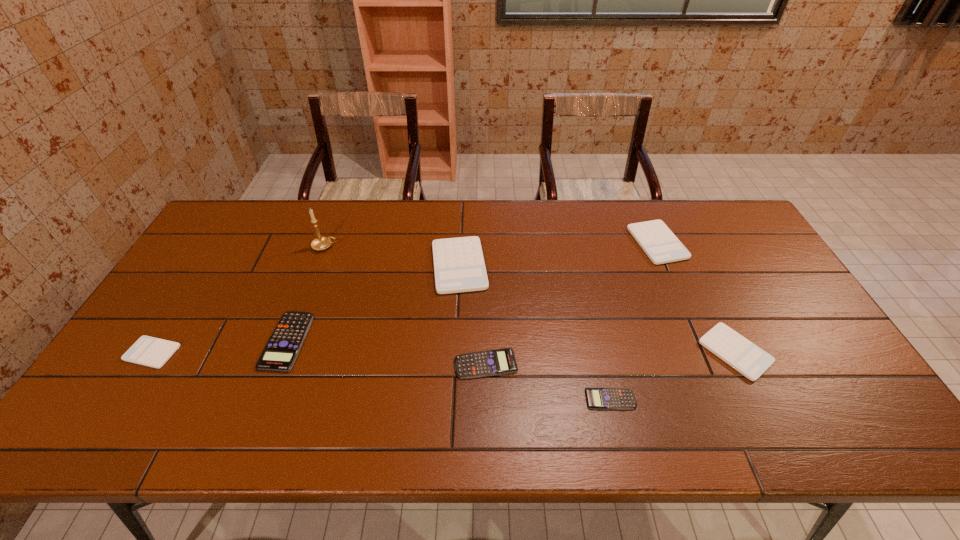
Identify the location of free space located 0.300m on the right of the leftmost white calculator. The height and width of the screenshot is (540, 960). (293, 353).

Locate an element on the screen. The height and width of the screenshot is (540, 960). free space located on the left of the second calculator from left to right is located at coordinates pos(142,341).

Image resolution: width=960 pixels, height=540 pixels. Find the location of `vacant space situated on the back of the second blue calculator from left to right`. vacant space situated on the back of the second blue calculator from left to right is located at coordinates (485, 249).

The image size is (960, 540). In order to click on free space located on the left of the rightmost blue calculator in this screenshot , I will do `click(446, 399)`.

The image size is (960, 540). Identify the location of candle holder that is at the far edge. (320, 243).

The height and width of the screenshot is (540, 960). I want to click on object present at the near edge, so coord(597,398).

The image size is (960, 540). What are the coordinates of `object present at the left edge` in the screenshot? It's located at (149, 351).

At what (x,y) coordinates should I click in order to perform the action: click on object situated at the right edge. Please return your answer as a coordinate pair (x, y). This screenshot has height=540, width=960. Looking at the image, I should click on (751, 361).

Locate an element on the screen. vacant space at the far edge of the desktop is located at coordinates (596, 217).

Where is `vacant space at the near edge of the desktop`? This screenshot has height=540, width=960. vacant space at the near edge of the desktop is located at coordinates (685, 444).